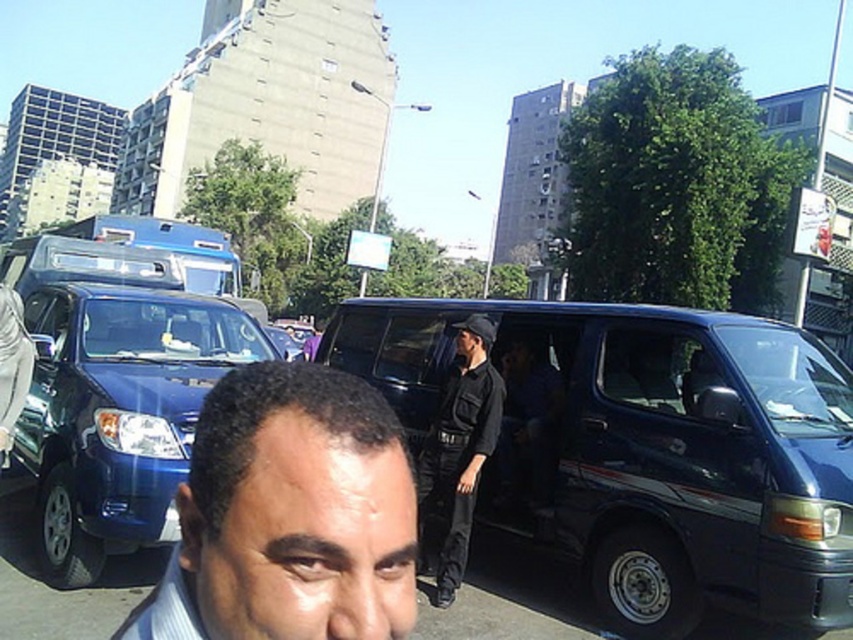
Question: Can you confirm if shiny dark blue van at center is bigger than smooth skin face at center?

Choices:
 (A) no
 (B) yes

Answer: (B)

Question: Which of these objects is positioned farthest from the smooth skin face at center?

Choices:
 (A) black uniform at center
 (B) shiny dark blue van at center

Answer: (B)

Question: Which point is closer to the camera?

Choices:
 (A) (602, 477)
 (B) (480, 317)
 (C) (259, 621)

Answer: (C)

Question: Is shiny dark blue van at center positioned before smooth skin face at center?

Choices:
 (A) no
 (B) yes

Answer: (A)

Question: Which object is closer to the camera taking this photo?

Choices:
 (A) shiny dark blue van at center
 (B) smooth skin face at center
 (C) black uniform at center

Answer: (B)

Question: Does shiny dark blue van at center have a lesser width compared to smooth skin face at center?

Choices:
 (A) yes
 (B) no

Answer: (B)